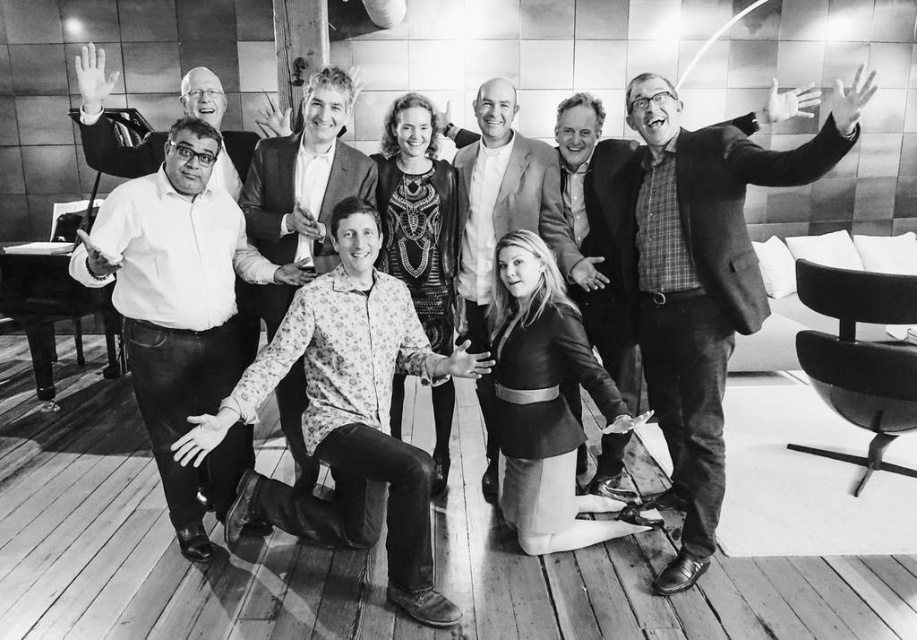
You are organizing a clothing display and need to place the leather jacket at center and the matte white shirt at left on a shelf. Which item should you place first if you want to arrange them from narrowest to widest?

The leather jacket at center has a lesser width compared to matte white shirt at left, so you should place the leather jacket at center first since it is narrower.

You are organizing a charity event and need to decide which of the two items, the plaid fabric shirt at right or the leather jacket at center, can be displayed in a 1.2 meter wide exhibition space. Based on their sizes, which one would fit better?

The plaid fabric shirt at right is bigger than the leather jacket at center, so the leather jacket at center would fit better in the 1.2 meter wide exhibition space.

You are standing in the room and want to hand a gift to the person wearing the plaid fabric shirt at right and the leather jacket at center. Which one can you reach without moving closer to them?

The plaid fabric shirt at right is closer to the viewer than the leather jacket at center, so you can reach the person wearing the plaid fabric shirt at right without moving closer.